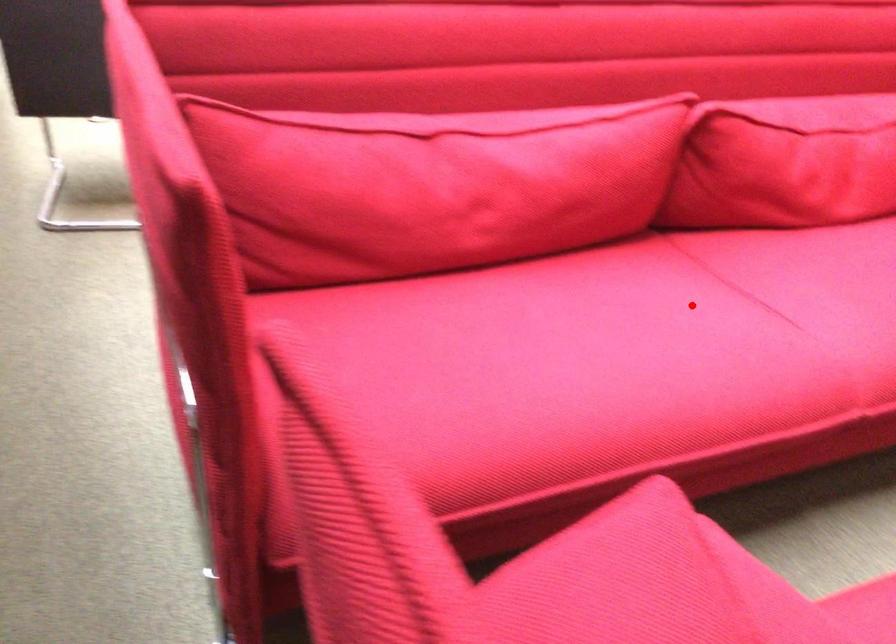
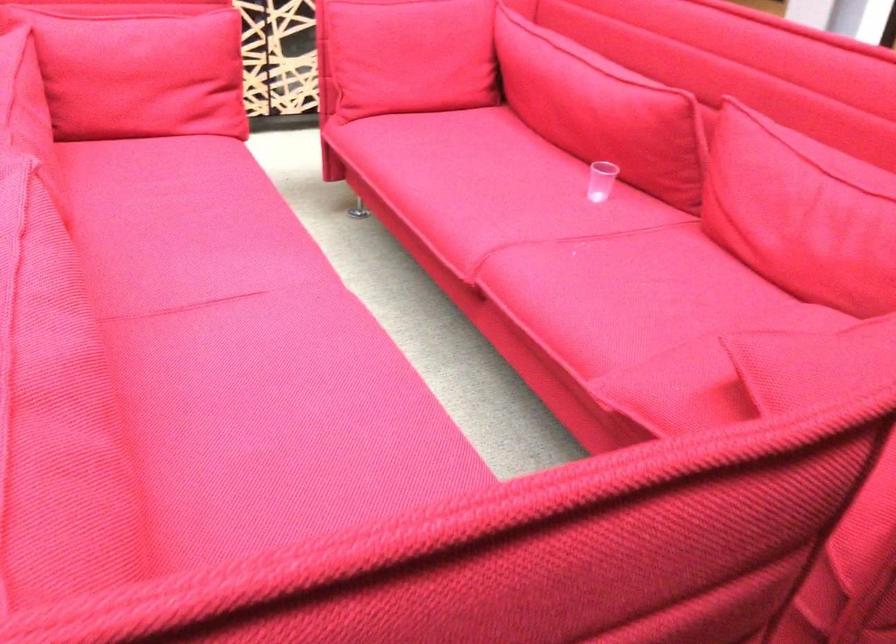
In the second image, find the point that corresponds to the highlighted location in the first image.

(243, 337)